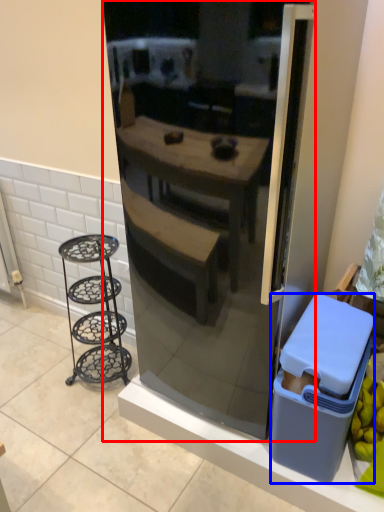
Question: Which point is further to the camera, refrigerator (highlighted by a red box) or trash bin/can (highlighted by a blue box)?

Choices:
 (A) refrigerator
 (B) trash bin/can

Answer: (B)